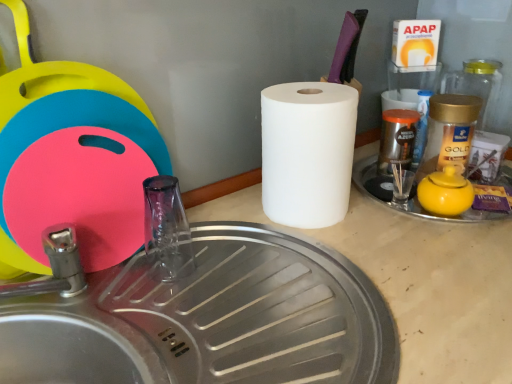
Identify the location of brushed metal sink at lower left. (210, 319).

Which is correct: yellow matte teapot at right is inside transparent glass faucet at center, or outside of it?

yellow matte teapot at right is not enclosed by transparent glass faucet at center.

Considering the sizes of yellow matte teapot at right and transparent glass faucet at center in the image, is yellow matte teapot at right wider or thinner than transparent glass faucet at center?

yellow matte teapot at right is wider than transparent glass faucet at center.

Can you tell me how much yellow matte teapot at right and transparent glass faucet at center differ in facing direction?

The facing directions of yellow matte teapot at right and transparent glass faucet at center are 29.1 degrees apart.

Considering the sizes of objects white matte paper towel at center and brushed metal sink at lower left in the image provided, who is bigger, white matte paper towel at center or brushed metal sink at lower left?

With larger size is brushed metal sink at lower left.

Who is shorter, white matte paper towel at center or brushed metal sink at lower left?

brushed metal sink at lower left.

From the image's perspective, is white matte paper towel at center above or below brushed metal sink at lower left?

Clearly, from the image's perspective, white matte paper towel at center is above brushed metal sink at lower left.

The image size is (512, 384). Find the location of `sink in front of the white matte paper towel at center`. sink in front of the white matte paper towel at center is located at coordinates (210, 319).

From a real-world perspective, which object rests below the other?

transparent glass faucet at center is physically lower.

From the image's perspective, is transparent glass faucet at center below white matte paper towel at center?

Indeed, from the image's perspective, transparent glass faucet at center is shown beneath white matte paper towel at center.

Is transparent glass faucet at center shorter than white matte paper towel at center?

Indeed, transparent glass faucet at center has a lesser height compared to white matte paper towel at center.

Looking at this image, is white matte paper towel at center at the back of transparent glass faucet at center?

No, transparent glass faucet at center's orientation is not away from white matte paper towel at center.

Can you confirm if yellow matte teapot at right is positioned to the right of brushed metal sink at lower left?

Correct, you'll find yellow matte teapot at right to the right of brushed metal sink at lower left.

From the image's perspective, between yellow matte teapot at right and brushed metal sink at lower left, which one is located above?

yellow matte teapot at right, from the image's perspective.

Is brushed metal sink at lower left completely or partially inside yellow matte teapot at right?

No, brushed metal sink at lower left is not a part of yellow matte teapot at right.

Considering the sizes of objects yellow matte teapot at right and brushed metal sink at lower left in the image provided, who is shorter, yellow matte teapot at right or brushed metal sink at lower left?

yellow matte teapot at right is shorter.

Is brushed metal sink at lower left outside of white matte paper towel at center?

Yes.

Are brushed metal sink at lower left and white matte paper towel at center beside each other?

No, brushed metal sink at lower left is not in contact with white matte paper towel at center.

From a real-world perspective, between brushed metal sink at lower left and white matte paper towel at center, who is vertically lower?

brushed metal sink at lower left, from a real-world perspective.

Locate an element on the screen. sink that appears in front of the white matte paper towel at center is located at coordinates (210, 319).

Considering the positions of point (201, 324) and point (432, 205), is point (201, 324) closer or farther from the camera than point (432, 205)?

Point (201, 324) is positioned closer to the camera compared to point (432, 205).

Is brushed metal sink at lower left beside yellow matte teapot at right?

No, brushed metal sink at lower left is not touching yellow matte teapot at right.

Identify the location of sink below the yellow matte teapot at right (from a real-world perspective). (210, 319).

Could you tell me if brushed metal sink at lower left is facing yellow matte teapot at right?

No, brushed metal sink at lower left does not turn towards yellow matte teapot at right.

Is yellow matte teapot at right aimed at white matte paper towel at center?

No, yellow matte teapot at right is not oriented towards white matte paper towel at center.

From a real-world perspective, is yellow matte teapot at right on white matte paper towel at center?

No.

Considering their positions, is yellow matte teapot at right located in front of or behind white matte paper towel at center?

Visually, yellow matte teapot at right is located behind white matte paper towel at center.

Is yellow matte teapot at right at the left side of white matte paper towel at center?

Incorrect, yellow matte teapot at right is not on the left side of white matte paper towel at center.

The height and width of the screenshot is (384, 512). What are the coordinates of `tea pot above the transparent glass faucet at center (from the image's perspective)` in the screenshot? It's located at pos(445,192).

You are a GUI agent. You are given a task and a screenshot of the screen. Output one action in this format:
    pyautogui.click(x=<x>, y=<y>)
    Task: Click on the sink to the left of white matte paper towel at center
    
    Given the screenshot: What is the action you would take?
    pyautogui.click(x=210, y=319)

Which object lies further to the anchor point brushed metal sink at lower left, white matte paper towel at center or yellow matte teapot at right?

The object further to brushed metal sink at lower left is yellow matte teapot at right.

From the image, which object appears to be farther from brushed metal sink at lower left, yellow matte teapot at right or transparent glass faucet at center?

Based on the image, yellow matte teapot at right appears to be further to brushed metal sink at lower left.

When comparing their distances from transparent glass faucet at center, does white matte paper towel at center or yellow matte teapot at right seem closer?

Among the two, white matte paper towel at center is located nearer to transparent glass faucet at center.

Based on their spatial positions, is transparent glass faucet at center or white matte paper towel at center closer to yellow matte teapot at right?

white matte paper towel at center is closer to yellow matte teapot at right.

When comparing their distances from white matte paper towel at center, does yellow matte teapot at right or transparent glass faucet at center seem closer?

yellow matte teapot at right.

From the image, which object appears to be farther from yellow matte teapot at right, brushed metal sink at lower left or transparent glass faucet at center?

The object further to yellow matte teapot at right is transparent glass faucet at center.

Looking at the image, which one is located further to brushed metal sink at lower left, yellow matte teapot at right or white matte paper towel at center?

yellow matte teapot at right is further to brushed metal sink at lower left.

Which object lies nearer to the anchor point transparent glass faucet at center, brushed metal sink at lower left or yellow matte teapot at right?

brushed metal sink at lower left is positioned closer to the anchor transparent glass faucet at center.

Where is `sink located between transparent glass faucet at center and yellow matte teapot at right in the left-right direction`? The width and height of the screenshot is (512, 384). sink located between transparent glass faucet at center and yellow matte teapot at right in the left-right direction is located at coordinates (210, 319).

Locate an element on the screen. This screenshot has width=512, height=384. paper towel between brushed metal sink at lower left and yellow matte teapot at right along the z-axis is located at coordinates (307, 152).

Where is `paper towel between transparent glass faucet at center and yellow matte teapot at right`? The height and width of the screenshot is (384, 512). paper towel between transparent glass faucet at center and yellow matte teapot at right is located at coordinates (307, 152).

Identify the location of faucet between brushed metal sink at lower left and white matte paper towel at center from front to back. [x=167, y=228].